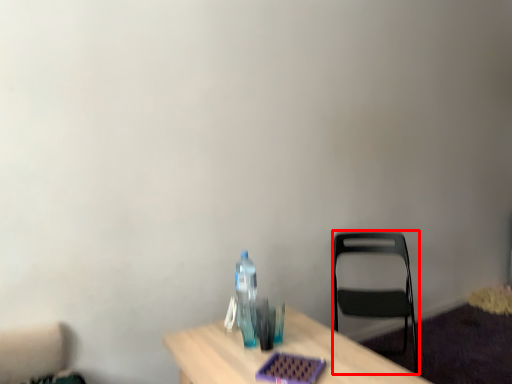
Question: Considering the relative positions of chair (annotated by the red box) and bottle in the image provided, where is chair (annotated by the red box) located with respect to the staircase?

Choices:
 (A) left
 (B) right

Answer: (B)